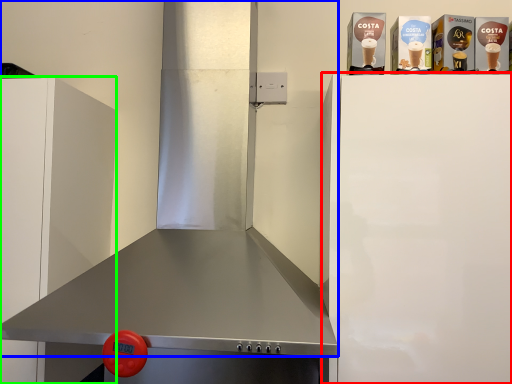
Question: Based on their relative distances, which object is nearer to appliance (highlighted by a red box)? Choose from exhaust hood (highlighted by a blue box) and cabinetry (highlighted by a green box).

Choices:
 (A) exhaust hood
 (B) cabinetry

Answer: (A)